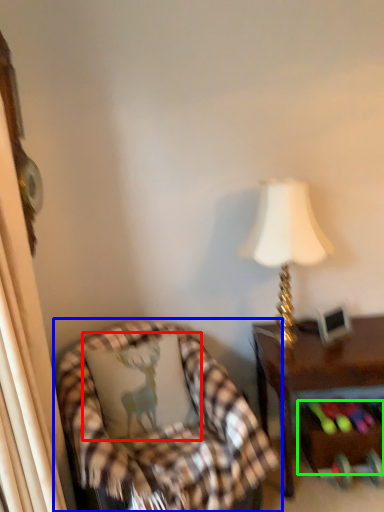
Question: Which object is positioned farthest from pillow (highlighted by a red box)? Select from chair (highlighted by a blue box) and drawer (highlighted by a green box).

Choices:
 (A) chair
 (B) drawer

Answer: (B)